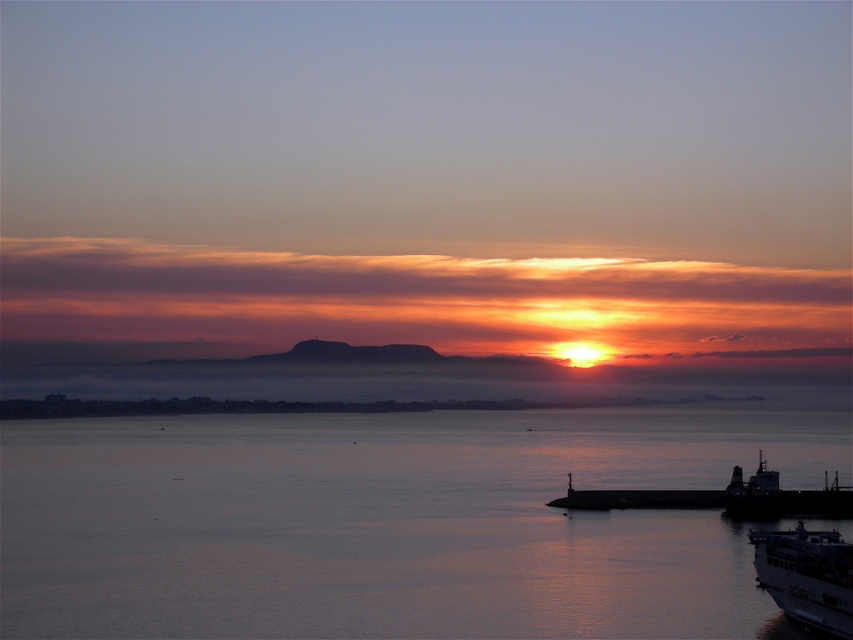
Question: Estimate the real-world distances between objects in this image. Which object is farther from the silvery metallic boat at lower right?

Choices:
 (A) smooth water at lower center
 (B) metallic gray ship at lower right
 (C) white glossy boat at lower right

Answer: (C)

Question: Which object appears farthest from the camera in this image?

Choices:
 (A) white glossy boat at lower right
 (B) silvery metallic boat at lower right

Answer: (B)

Question: Can you confirm if silvery metallic boat at lower right is thinner than metallic gray ship at lower right?

Choices:
 (A) no
 (B) yes

Answer: (A)

Question: Which point appears closest to the camera in this image?

Choices:
 (A) (752, 428)
 (B) (740, 504)

Answer: (B)

Question: Does white glossy boat at lower right come in front of silvery metallic boat at lower right?

Choices:
 (A) yes
 (B) no

Answer: (A)

Question: Does silvery metallic boat at lower right have a greater width compared to metallic gray ship at lower right?

Choices:
 (A) no
 (B) yes

Answer: (B)